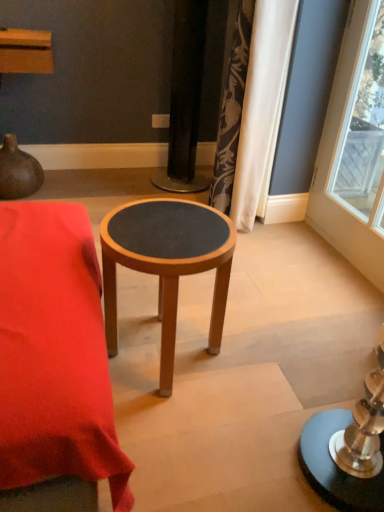
Locate an element on the screen. The image size is (384, 512). blank space above wooden stool at center (from a real-world perspective) is located at coordinates (38, 270).